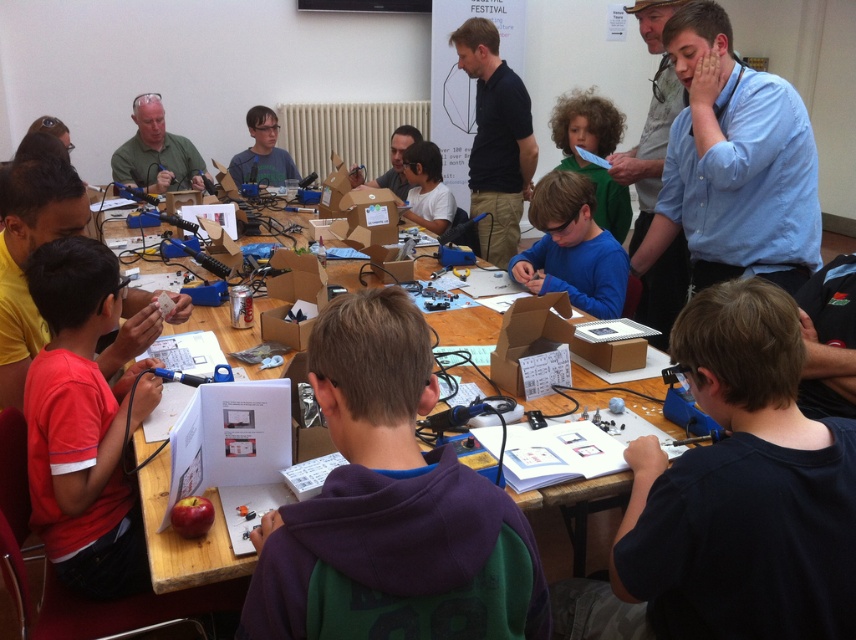
Does blue shirt at upper right have a larger size compared to wooden table at center?

Yes, blue shirt at upper right is bigger than wooden table at center.

Who is more forward, (x=706, y=140) or (x=551, y=499)?

Point (x=551, y=499) is more forward.

Describe the element at coordinates (733, 164) in the screenshot. This screenshot has width=856, height=640. I see `blue shirt at upper right` at that location.

You are a GUI agent. You are given a task and a screenshot of the screen. Output one action in this format:
    pyautogui.click(x=<x>, y=<y>)
    Task: Click on the blue shirt at upper right
    The width and height of the screenshot is (856, 640).
    Given the screenshot: What is the action you would take?
    pyautogui.click(x=733, y=164)

Is purple hoodie at center positioned at the back of matte white shirt at center?

No, it is in front of matte white shirt at center.

What do you see at coordinates (390, 506) in the screenshot? This screenshot has height=640, width=856. I see `purple hoodie at center` at bounding box center [390, 506].

At what (x,y) coordinates should I click in order to perform the action: click on purple hoodie at center. Please return your answer as a coordinate pair (x, y). Looking at the image, I should click on (390, 506).

Does red cotton shirt at left have a larger size compared to matte black laptop at center?

No, red cotton shirt at left is not bigger than matte black laptop at center.

Who is more forward, [146,358] or [391,173]?

Positioned in front is point [146,358].

Locate an element on the screen. red cotton shirt at left is located at coordinates (81, 426).